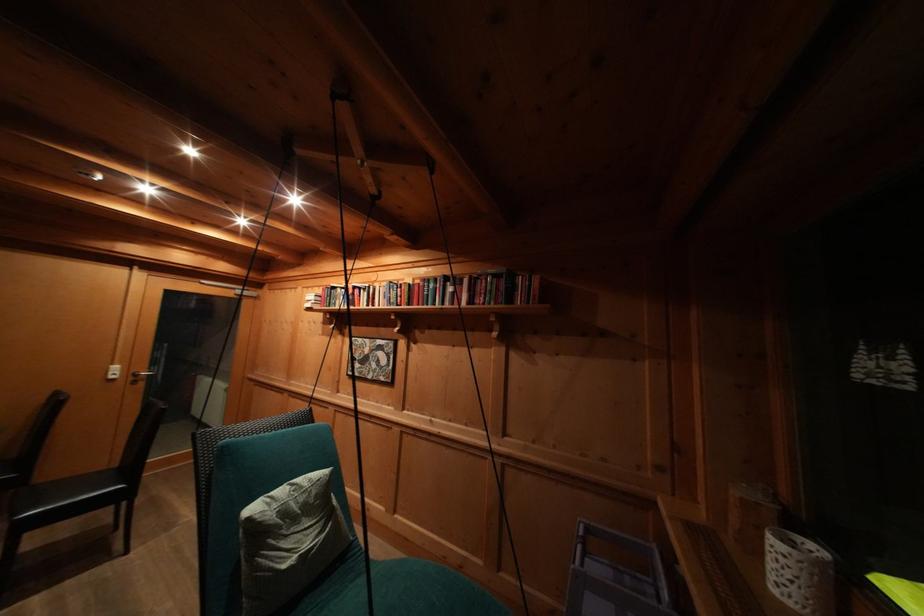
Where would you push the white light switch? Please return your answer as a coordinate pair (x, y).

(113, 371)